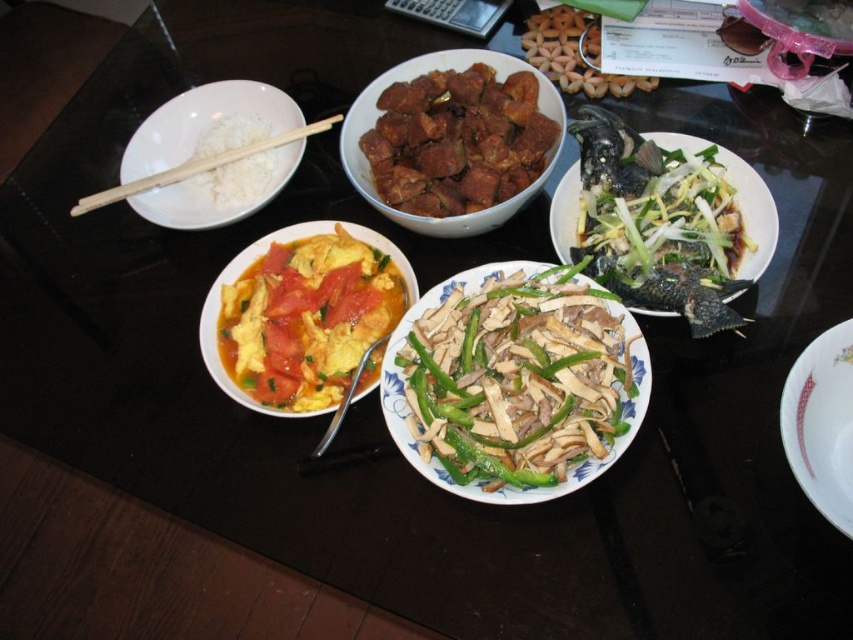
You are a food critic trying to take a photo of the brown glossy meat at center and the white wood chopsticks at upper left. Which object will appear larger in your photo?

The brown glossy meat at center will appear larger in the photo because it is much taller than the white wood chopsticks at upper left.

You are a guest at a dinner and want to use the white wood chopsticks at upper left to eat the green glazed fish at upper right. Can you reach the fish with the chopsticks without moving them?

The green glazed fish at upper right is positioned under the white wood chopsticks at upper left, so yes, you can reach the fish with the chopsticks without moving them.